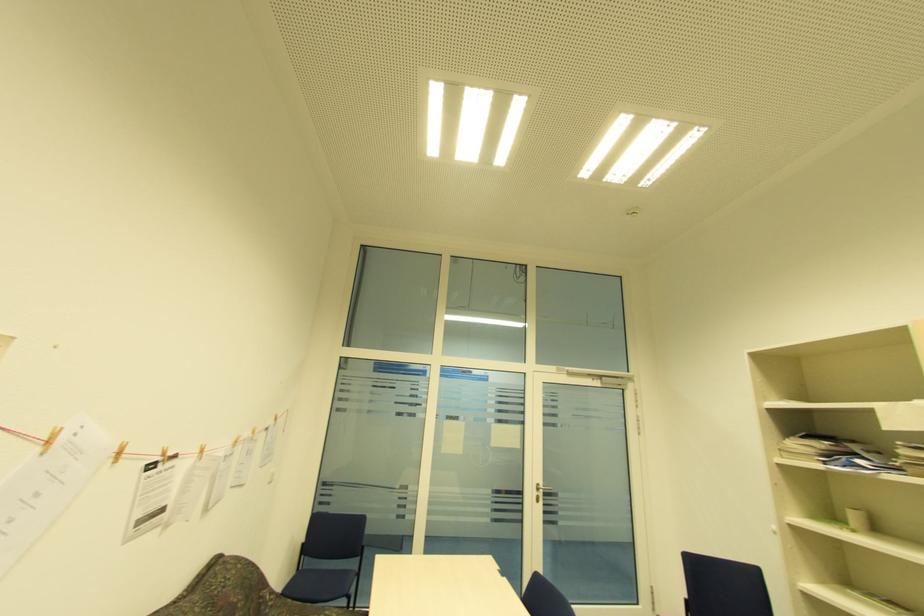
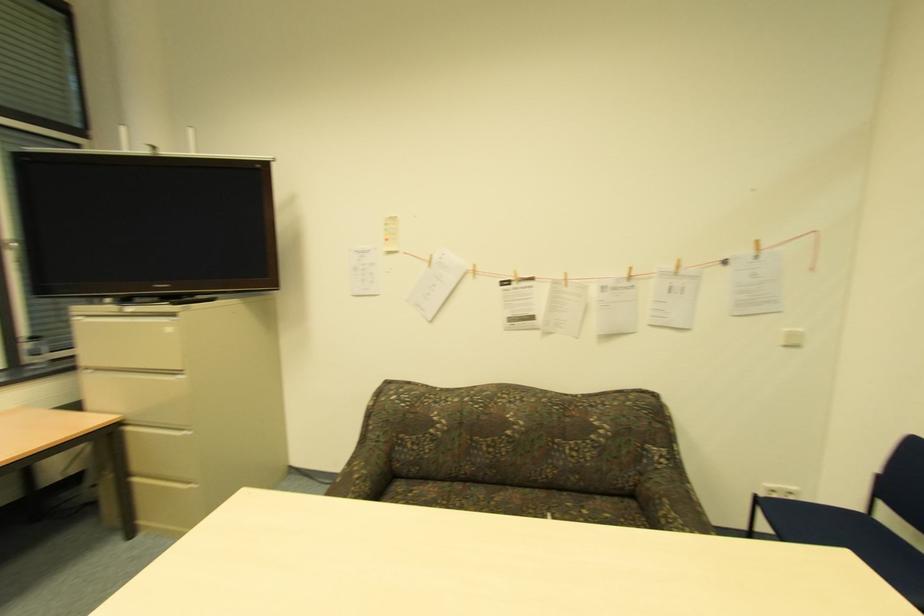
In the second image, find the point that corresponds to pixel 42 448 in the first image.

(428, 265)